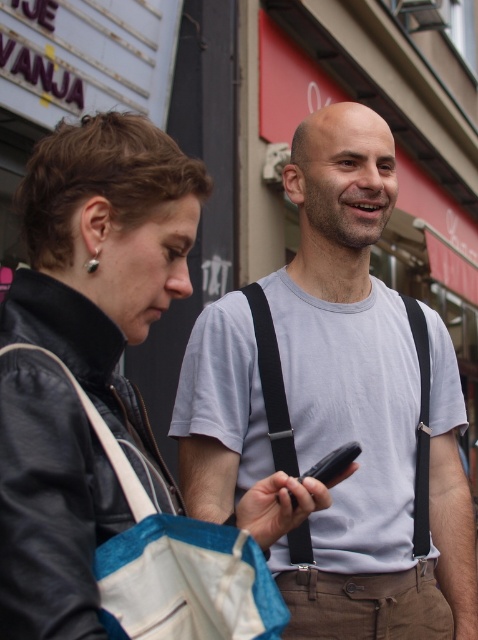
Can you confirm if gray cotton shirt at center is smaller than black matte smartphone at center?

No.

Who is positioned more to the left, gray cotton shirt at center or black matte smartphone at center?

black matte smartphone at center

Who is more forward, (226, 371) or (338, 458)?

Point (338, 458) is in front.

The width and height of the screenshot is (478, 640). I want to click on gray cotton shirt at center, so click(x=365, y=406).

Which is in front, point (310, 410) or point (145, 608)?

Positioned in front is point (145, 608).

Which is below, gray cotton shirt at center or blue fabric shopping bag at center?

blue fabric shopping bag at center is below.

Is point (337, 266) in front of point (109, 445)?

No, it is not.

Where is `gray cotton shirt at center`? gray cotton shirt at center is located at coordinates (365, 406).

Is blue fabric shopping bag at center positioned at the back of black matte smartphone at center?

No, it is in front of black matte smartphone at center.

Is blue fabric shopping bag at center wider than black matte smartphone at center?

Yes.

I want to click on blue fabric shopping bag at center, so click(x=174, y=563).

Image resolution: width=478 pixels, height=640 pixels. Identify the location of blue fabric shopping bag at center. (174, 563).